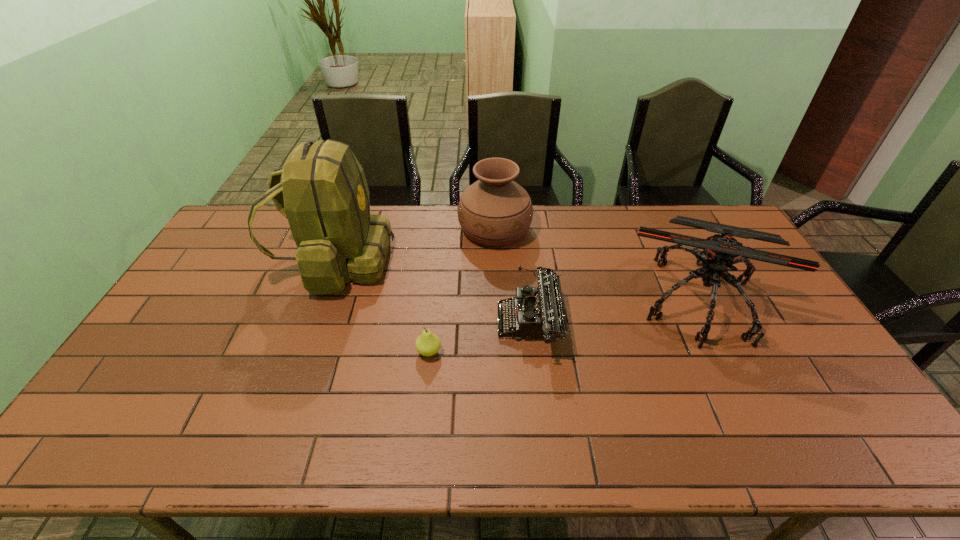
Find the location of a particular element. The image size is (960, 540). the tallest object is located at coordinates (325, 197).

Image resolution: width=960 pixels, height=540 pixels. Find the location of `backpack`. backpack is located at coordinates (325, 197).

The image size is (960, 540). Find the location of `urn`. urn is located at coordinates (494, 211).

Locate an element on the screen. The height and width of the screenshot is (540, 960). the rightmost object is located at coordinates 720,252.

What are the coordinates of `typewriter` in the screenshot? It's located at (538, 312).

Locate an element on the screen. the fourth object from right to left is located at coordinates (427, 344).

What are the coordinates of `free location located on the front-facing side of the tallest object` in the screenshot? It's located at (506, 261).

Locate an element on the screen. The height and width of the screenshot is (540, 960). free space located on the right of the urn is located at coordinates (632, 229).

This screenshot has width=960, height=540. What are the coordinates of `vacant space located 0.060m on the left of the drone` in the screenshot? It's located at (610, 299).

Locate an element on the screen. The image size is (960, 540). free space located 0.140m on the keyboard of the typewriter is located at coordinates (449, 323).